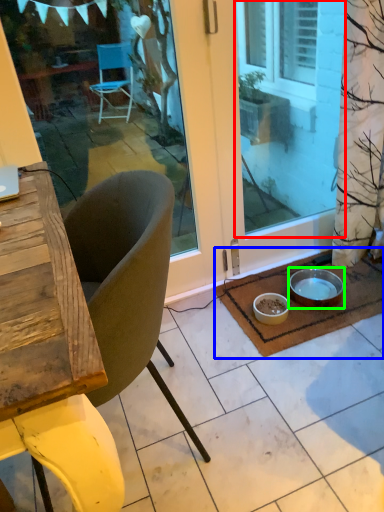
Question: Estimate the real-world distances between objects in this image. Which object is closer to window screen (highlighted by a red box), doormat (highlighted by a blue box) or bowl (highlighted by a green box)?

Choices:
 (A) doormat
 (B) bowl

Answer: (A)